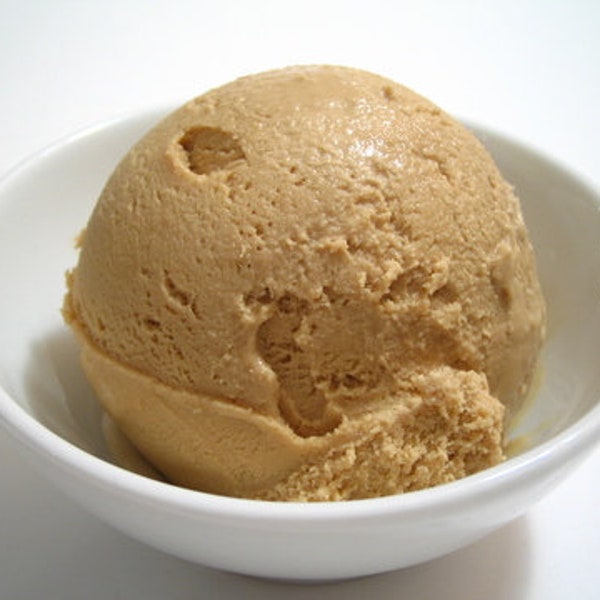
At what (x,y) coordinates should I click in order to perform the action: click on white reflected light on rim of bowl. Please return your answer as a coordinate pair (x, y). The image size is (600, 600). Looking at the image, I should click on pyautogui.click(x=84, y=131).